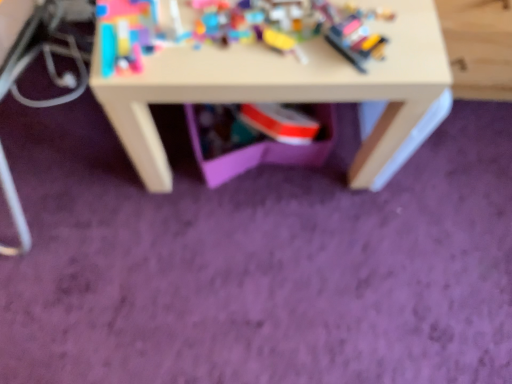
You are a GUI agent. You are given a task and a screenshot of the screen. Output one action in this format:
    pyautogui.click(x=<x>, y=<y>)
    Task: Click on the free space underneath plastic building blocks at upper center (from a real-world perspective)
    
    Given the screenshot: What is the action you would take?
    pyautogui.click(x=234, y=30)